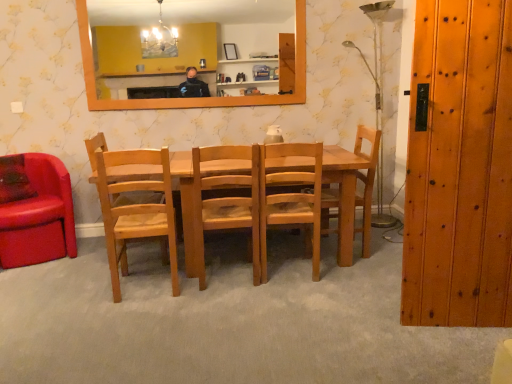
Question: Is wooden chair at center, positioned as the fifth chair in left-to-right order, situated inside light brown wood chair at center, which appears as the second chair when viewed from the right, or outside?

Choices:
 (A) inside
 (B) outside

Answer: (B)

Question: From the image's perspective, relative to light brown wood chair at center, which appears as the second chair when viewed from the right, is wooden chair at center, the first chair viewed from the right, above or below?

Choices:
 (A) above
 (B) below

Answer: (A)

Question: Considering the real-world distances, which object is farthest from the orange wooden mirror at upper center?

Choices:
 (A) wooden door at right
 (B) light brown wood chair at center, marked as the 4th chair in a left-to-right arrangement
 (C) wooden chair at center, the third chair in the left-to-right sequence
 (D) natural wood chair at left, which is the 4th chair in right-to-left order
 (E) wooden chair at center, positioned as the fifth chair in left-to-right order

Answer: (A)

Question: Which is farther from the wooden chair at center, the third chair in the left-to-right sequence?

Choices:
 (A) wooden door at right
 (B) orange wooden mirror at upper center
 (C) wooden chair at center, positioned as the fifth chair in left-to-right order
 (D) natural wood chair at left, which is the 4th chair in right-to-left order
 (E) light brown wood chair at center, which appears as the second chair when viewed from the right

Answer: (B)